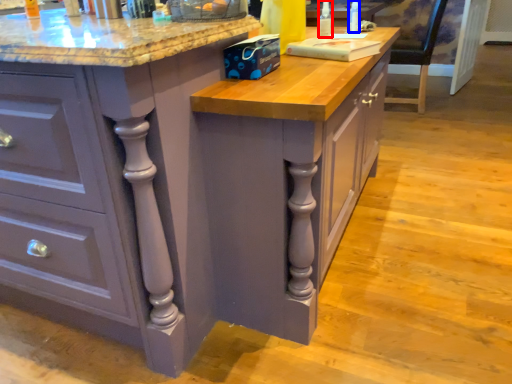
Question: Which object is further to the camera taking this photo, bottle (highlighted by a red box) or bottle (highlighted by a blue box)?

Choices:
 (A) bottle
 (B) bottle

Answer: (B)